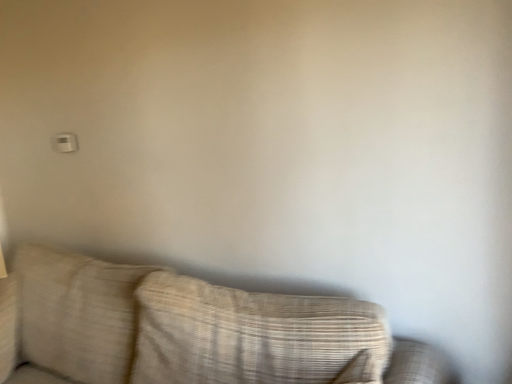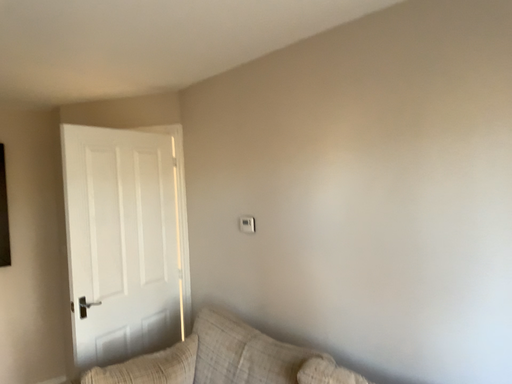
Question: Which way did the camera rotate in the video?

Choices:
 (A) rotated downward
 (B) rotated upward

Answer: (B)